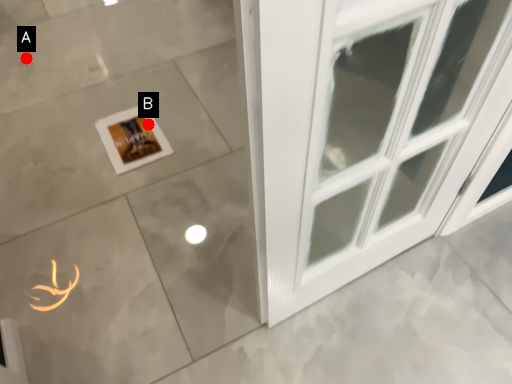
Question: Two points are circled on the image, labeled by A and B beside each circle. Which point is closer to the camera taking this photo?

Choices:
 (A) A is closer
 (B) B is closer

Answer: (B)